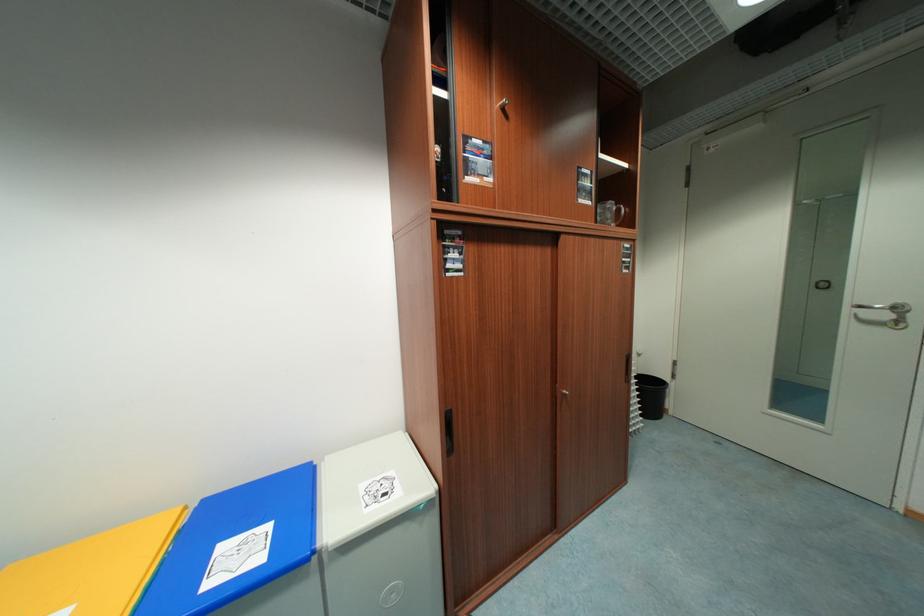
Describe the element at coordinates (110, 565) in the screenshot. The image size is (924, 616). I see `the yellow bin lid` at that location.